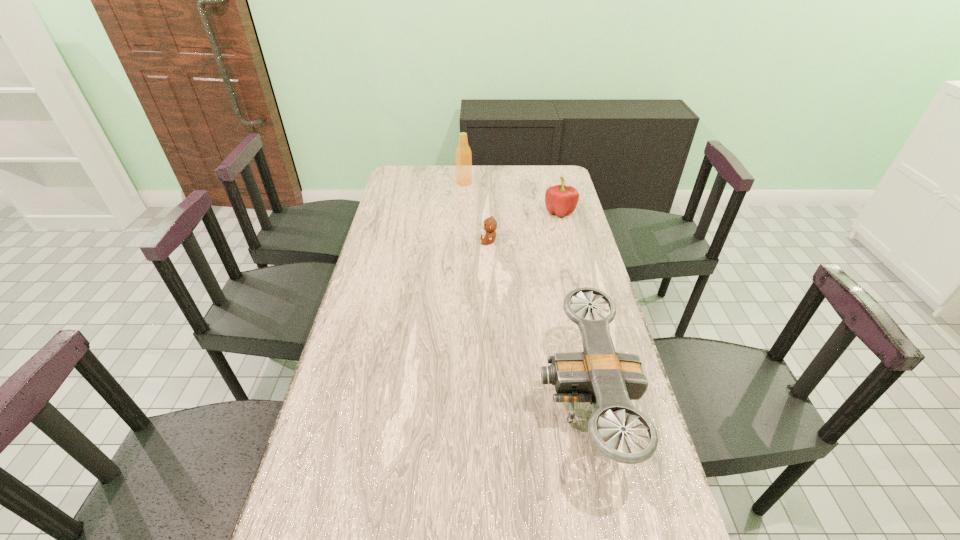
What are the coordinates of `free region located 0.110m on the front-facing side of the nearest object` in the screenshot? It's located at (494, 402).

I want to click on vacant space located 0.310m on the front-facing side of the nearest object, so click(x=419, y=402).

In order to click on free region located 0.350m on the left of the bell pepper in this screenshot , I will do `click(460, 211)`.

Identify the location of free space located 0.370m on the face of the teddy bear. (383, 241).

This screenshot has width=960, height=540. What are the coordinates of `vacant area located on the face of the teddy bear` in the screenshot? It's located at click(415, 241).

Image resolution: width=960 pixels, height=540 pixels. I want to click on free location located on the face of the teddy bear, so click(420, 241).

Locate an element on the screen. object present at the far edge is located at coordinates (463, 156).

What are the coordinates of `drone at the right edge` in the screenshot? It's located at (609, 380).

Find the location of a particular element. bell pepper located in the right edge section of the desktop is located at coordinates 560,199.

The width and height of the screenshot is (960, 540). In order to click on vacant space at the far edge of the desktop in this screenshot , I will do `click(521, 184)`.